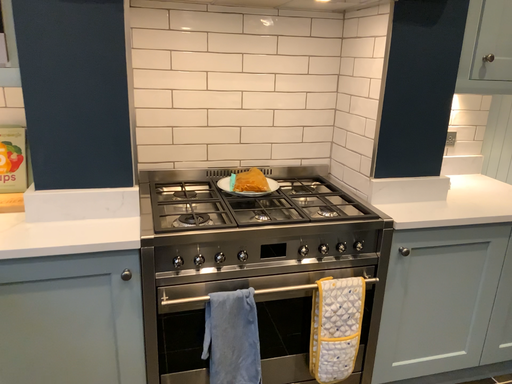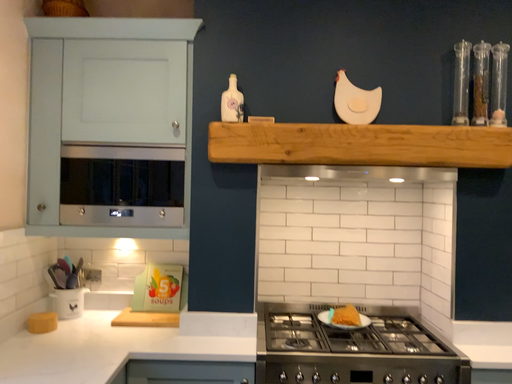
Question: How did the camera likely rotate when shooting the video?

Choices:
 (A) rotated downward
 (B) rotated upward

Answer: (B)